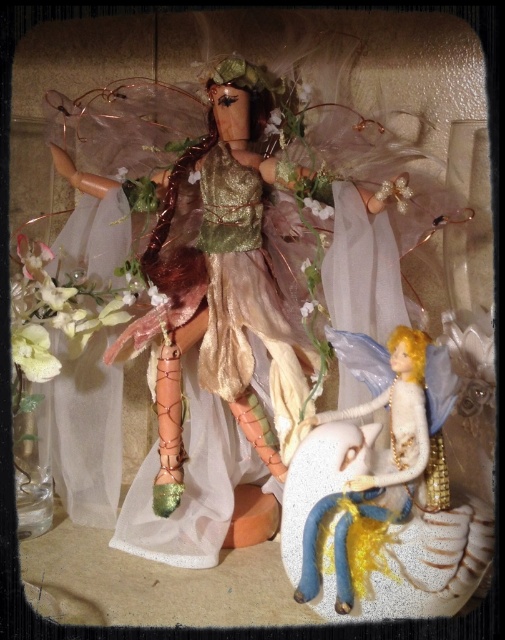
You are a tiny creature that is 10 centimeters tall. You want to jump from the shiny gold fabric dress at center to the blue fabric unicorn at lower center. Can you make the jump successfully?

The distance between the shiny gold fabric dress at center and the blue fabric unicorn at lower center is 18.46 centimeters. Since you are only 10 centimeters tall, the jump is longer than your height, so you might not make it successfully.

You are an interior designer arranging a display case. You have a shiny gold fabric dress at center and a blue fabric unicorn at lower center. Which object takes up more horizontal space in the display?

The shiny gold fabric dress at center has a greater width than the blue fabric unicorn at lower center, so it occupies more horizontal space in the display.

You are a photographer setting up for a photoshoot. You have a camera and a shiny gold fabric dress at center. The dress is part of a fairy doll costume. You want to ensure the dress is in focus while the background remains slightly blurred. Based on the scene description, what is the minimum distance you should set between the camera and the dress to achieve this effect?

The minimum distance should be set to 94.25 centimeters because the camera and the shiny gold fabric dress at center are 94.25 centimeters apart.